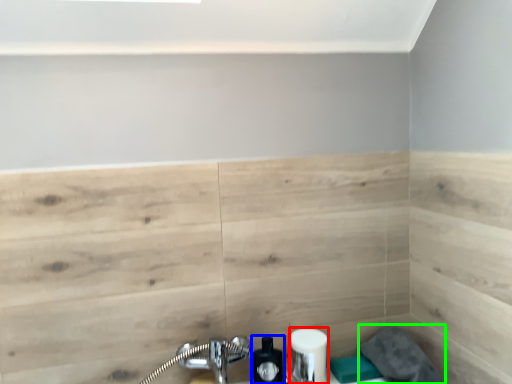
Question: Considering the real-world distances, which object is farthest from toiletry (highlighted by a red box)? soap dispenser (highlighted by a blue box) or gray (highlighted by a green box)?

Choices:
 (A) soap dispenser
 (B) gray

Answer: (B)